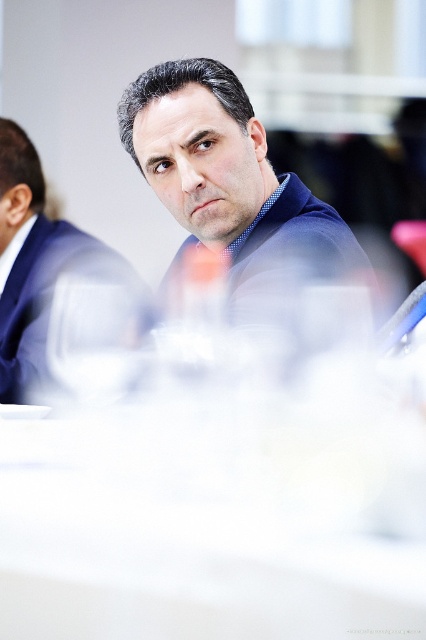
Question: Is white glossy table at center further to the viewer compared to blue sweater at center?

Choices:
 (A) no
 (B) yes

Answer: (A)

Question: Can you confirm if white glossy table at center is positioned to the right of blue sweater at center?

Choices:
 (A) yes
 (B) no

Answer: (B)

Question: Estimate the real-world distances between objects in this image. Which object is closer to the matte blue suit at center?

Choices:
 (A) white glossy table at center
 (B) blue sweater at center

Answer: (B)

Question: Among these points, which one is farthest from the camera?

Choices:
 (A) coord(183,152)
 (B) coord(100,392)
 (C) coord(399,612)

Answer: (A)

Question: Estimate the real-world distances between objects in this image. Which object is farther from the blue sweater at center?

Choices:
 (A) matte blue suit at center
 (B) white glossy table at center

Answer: (B)

Question: Does white glossy table at center have a smaller size compared to blue sweater at center?

Choices:
 (A) no
 (B) yes

Answer: (B)